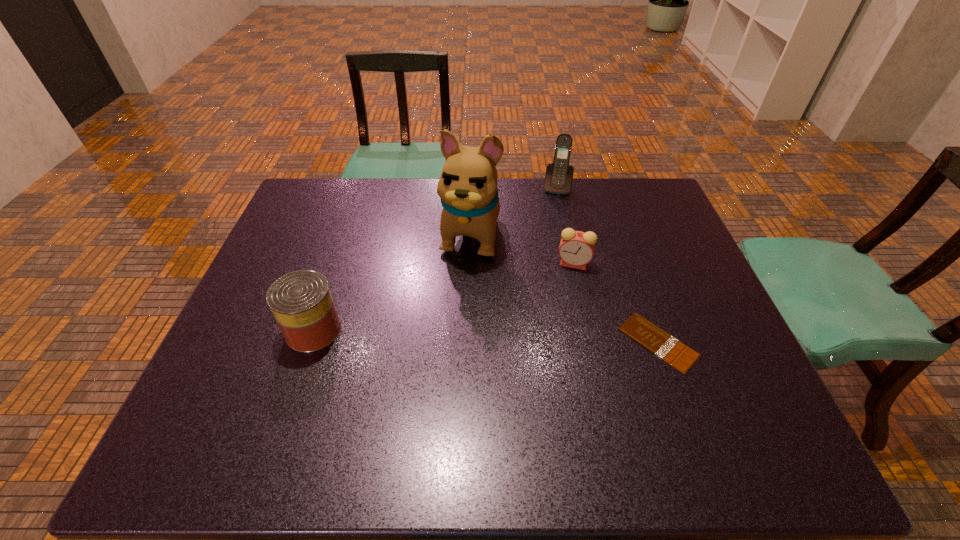
Where is `the leftmost object`? The height and width of the screenshot is (540, 960). the leftmost object is located at coordinates pos(301,302).

The image size is (960, 540). Identify the location of the third shortest object. (301, 302).

Find the location of `the shortest object`. the shortest object is located at coordinates (656, 340).

You are a GUI agent. You are given a task and a screenshot of the screen. Output one action in this format:
    pyautogui.click(x=<x>, y=<y>)
    Task: Click on the rightmost object
    
    Given the screenshot: What is the action you would take?
    tap(656, 340)

Locate an element on the screen. The height and width of the screenshot is (540, 960). the second object from left to right is located at coordinates (467, 187).

Identify the location of the tallest object. (467, 187).

Where is `alarm clock`? This screenshot has height=540, width=960. alarm clock is located at coordinates (576, 249).

At what (x,y) coordinates should I click in order to perform the action: click on the farthest object. Please return your answer as a coordinate pair (x, y). The width and height of the screenshot is (960, 540). Looking at the image, I should click on (558, 179).

Image resolution: width=960 pixels, height=540 pixels. Find the location of `the fourth shortest object`. the fourth shortest object is located at coordinates (558, 179).

Locate an element on the screen. Image resolution: width=960 pixels, height=540 pixels. vacant space located on the left of the third shortest object is located at coordinates (250, 330).